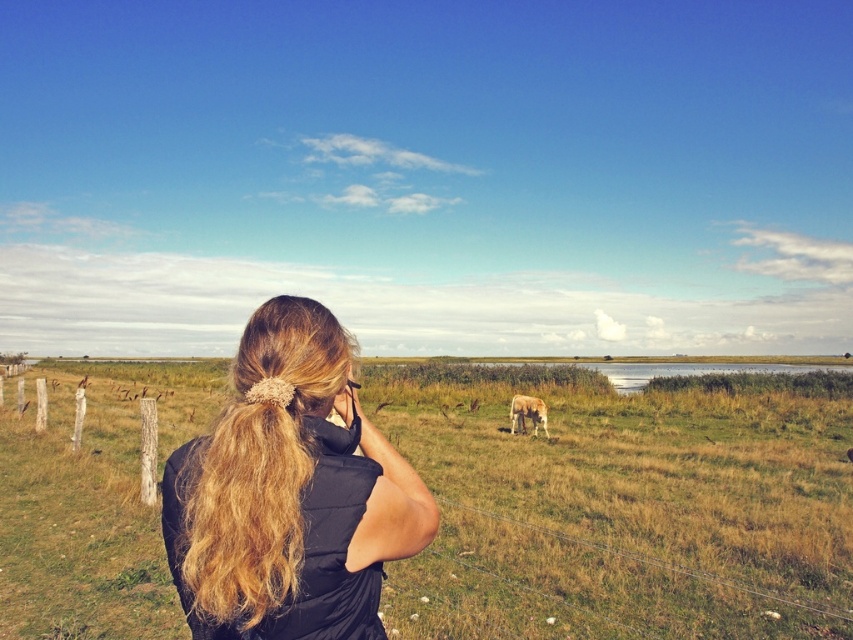
Question: Which object is the farthest from the white fur horse at center?

Choices:
 (A) blonde hair at center
 (B) green grass at center

Answer: (A)

Question: Is blonde hair at center further to camera compared to white fur horse at center?

Choices:
 (A) no
 (B) yes

Answer: (A)

Question: Which object is closer to the camera taking this photo?

Choices:
 (A) blonde hair at center
 (B) green grass at center
 (C) white fur horse at center

Answer: (A)

Question: Is blonde hair at center bigger than white fur horse at center?

Choices:
 (A) yes
 (B) no

Answer: (A)

Question: Estimate the real-world distances between objects in this image. Which object is farther from the white fur horse at center?

Choices:
 (A) blonde hair at center
 (B) green grass at center

Answer: (A)

Question: Does green grass at center have a lesser width compared to white fur horse at center?

Choices:
 (A) no
 (B) yes

Answer: (A)